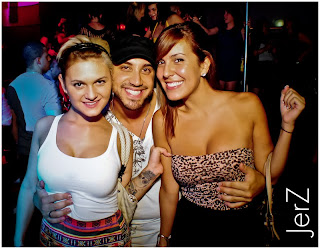
Where is `stripper pole`? stripper pole is located at coordinates (245, 36).